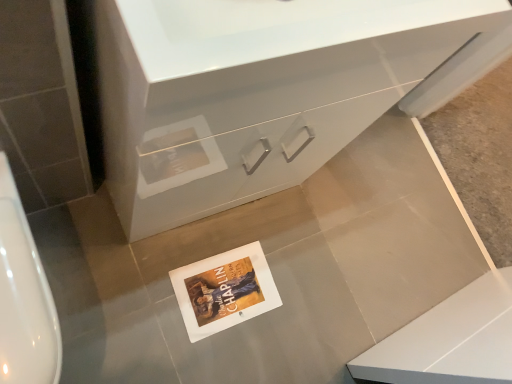
The width and height of the screenshot is (512, 384). In order to click on free space to the back side of white paper postcard at center in this screenshot , I will do `click(278, 238)`.